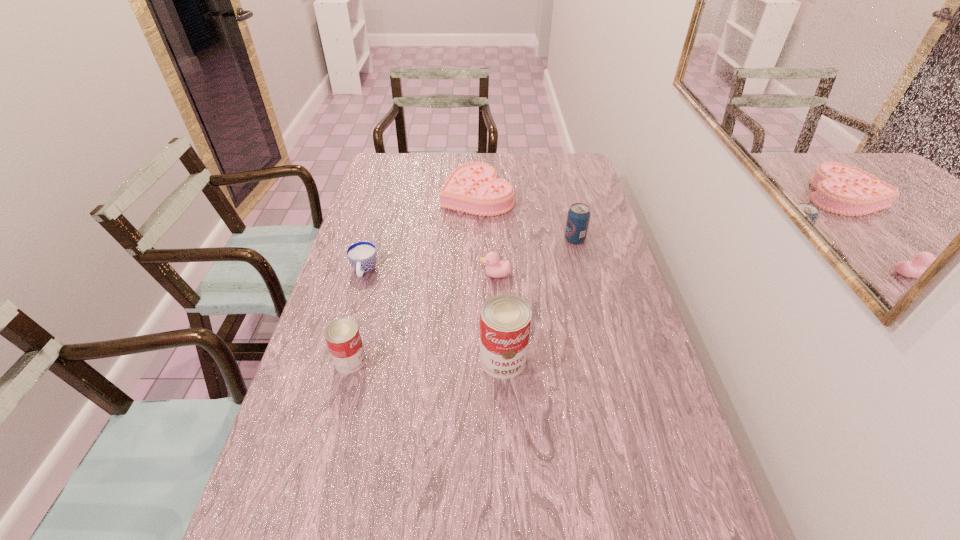
Where is `the left can`? The image size is (960, 540). the left can is located at coordinates (342, 336).

The width and height of the screenshot is (960, 540). I want to click on the right can, so 505,319.

The image size is (960, 540). Identify the location of the tallest object. (505, 319).

This screenshot has width=960, height=540. Find the location of `cake`. cake is located at coordinates (473, 188).

The image size is (960, 540). Find the location of `the rightmost object`. the rightmost object is located at coordinates pyautogui.click(x=578, y=217).

The height and width of the screenshot is (540, 960). Identify the location of pop soda. (578, 217).

I want to click on duckling, so click(495, 268).

At what (x,y) coordinates should I click in order to perform the action: click on cup. Please return your answer as a coordinate pair (x, y). Looking at the image, I should click on (362, 255).

You are a GUI agent. You are given a task and a screenshot of the screen. Output one action in this format:
    pyautogui.click(x=<x>, y=<y>)
    Task: Click on the vacant space located on the front label of the shorter can
    
    Given the screenshot: What is the action you would take?
    pyautogui.click(x=428, y=361)

Locate an element on the screen. This screenshot has height=540, width=960. vacant area situated on the front label of the taller can is located at coordinates (508, 467).